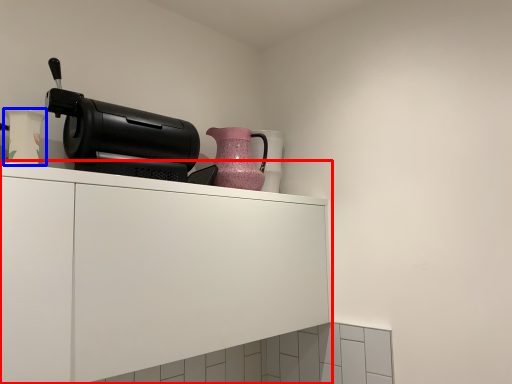
Question: Which point is closer to the camera, cabinetry (highlighted by a red box) or vase (highlighted by a blue box)?

Choices:
 (A) cabinetry
 (B) vase

Answer: (A)